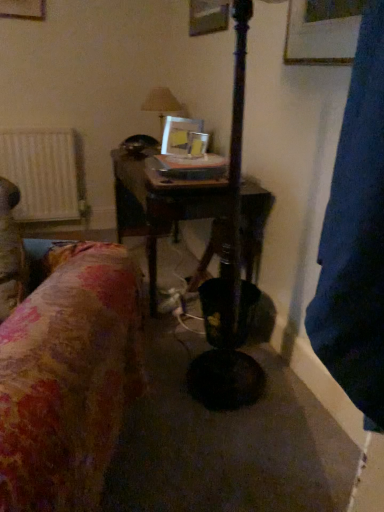
This screenshot has width=384, height=512. What do you see at coordinates (161, 105) in the screenshot?
I see `matte white lampshade at center` at bounding box center [161, 105].

Where is `metallic silver picture frame at center`? The height and width of the screenshot is (512, 384). metallic silver picture frame at center is located at coordinates (178, 131).

Are white textured radiator at left and matte white lampshade at center beside each other?

white textured radiator at left is not next to matte white lampshade at center, and they're not touching.

From the image's perspective, is white textured radiator at left under matte white lampshade at center?

Correct, white textured radiator at left appears lower than matte white lampshade at center in the image.

From the picture: How different are the orientations of white textured radiator at left and matte white lampshade at center in degrees?

90 degrees.

Considering the sizes of objects white textured radiator at left and matte white lampshade at center in the image provided, who is smaller, white textured radiator at left or matte white lampshade at center?

Smaller between the two is matte white lampshade at center.

Does matte white lampshade at center have a lesser width compared to white textured radiator at left?

Incorrect, the width of matte white lampshade at center is not less than that of white textured radiator at left.

Is the depth of matte white lampshade at center less than that of white textured radiator at left?

Yes, the depth of matte white lampshade at center is less than that of white textured radiator at left.

Considering the relative positions of metallic silver picture frame at center and matte white lampshade at center in the image provided, is metallic silver picture frame at center behind matte white lampshade at center?

No, metallic silver picture frame at center is closer to the viewer.

Is matte white lampshade at center surrounded by metallic silver picture frame at center?

No, matte white lampshade at center is not a part of metallic silver picture frame at center.

Is metallic silver picture frame at center touching matte white lampshade at center?

No, metallic silver picture frame at center is not with matte white lampshade at center.

Is matte white lampshade at center situated inside metallic silver picture frame at center or outside?

matte white lampshade at center is not enclosed by metallic silver picture frame at center.

From a real-world perspective, is matte white lampshade at center beneath metallic silver picture frame at center?

Incorrect, from a real-world perspective, matte white lampshade at center is higher than metallic silver picture frame at center.

From the image's perspective, is matte white lampshade at center located above or below metallic silver picture frame at center?

matte white lampshade at center is situated higher than metallic silver picture frame at center in the image.

Consider the image. Is metallic silver picture frame at center in front of or behind white textured radiator at left in the image?

metallic silver picture frame at center is positioned closer to the viewer than white textured radiator at left.

Does metallic silver picture frame at center have a greater width compared to white textured radiator at left?

No.

From the image's perspective, would you say metallic silver picture frame at center is positioned over white textured radiator at left?

Yes.

Which is more to the left, metallic silver picture frame at center or white textured radiator at left?

white textured radiator at left is more to the left.

Which is behind, point (26, 210) or point (169, 147)?

The point (26, 210) is farther from the camera.

Between white textured radiator at left and metallic silver picture frame at center, which one has smaller size?

metallic silver picture frame at center is smaller.

Is white textured radiator at left surrounding metallic silver picture frame at center?

No.

What's the angular difference between wooden table at center and white textured radiator at left's facing directions?

90 degrees separate the facing orientations of wooden table at center and white textured radiator at left.

Locate an element on the screen. This screenshot has width=384, height=512. table on the right of white textured radiator at left is located at coordinates (159, 207).

Which object is further away from the camera taking this photo, wooden table at center or white textured radiator at left?

Positioned behind is white textured radiator at left.

Is wooden table at center shorter than white textured radiator at left?

Incorrect, the height of wooden table at center does not fall short of that of white textured radiator at left.

I want to click on radiator located on the left of matte white lampshade at center, so click(x=43, y=173).

Where is `table lamp above the white textured radiator at left (from a real-world perspective)`? table lamp above the white textured radiator at left (from a real-world perspective) is located at coordinates (161, 105).

From the picture: From the image, which object appears to be farther from wooden table at center, metallic silver picture frame at center or matte white lampshade at center?

Based on the image, matte white lampshade at center appears to be further to wooden table at center.

From the image, which object appears to be nearer to metallic silver picture frame at center, white textured radiator at left or matte white lampshade at center?

Among the two, matte white lampshade at center is located nearer to metallic silver picture frame at center.

Estimate the real-world distances between objects in this image. Which object is closer to metallic silver picture frame at center, wooden table at center or white textured radiator at left?

Based on the image, wooden table at center appears to be nearer to metallic silver picture frame at center.

From the image, which object appears to be nearer to matte white lampshade at center, white textured radiator at left or wooden table at center?

Among the two, wooden table at center is located nearer to matte white lampshade at center.

From the picture: Estimate the real-world distances between objects in this image. Which object is further from white textured radiator at left, matte white lampshade at center or wooden table at center?

wooden table at center is further to white textured radiator at left.

From the image, which object appears to be nearer to matte white lampshade at center, wooden table at center or white textured radiator at left?

Based on the image, wooden table at center appears to be nearer to matte white lampshade at center.

When comparing their distances from wooden table at center, does metallic silver picture frame at center or white textured radiator at left seem closer?

The object closer to wooden table at center is metallic silver picture frame at center.

Looking at the image, which one is located further to white textured radiator at left, wooden table at center or matte white lampshade at center?

Among the two, wooden table at center is located further to white textured radiator at left.

Where is `picture frame between wooden table at center and matte white lampshade at center in the front-back direction`? This screenshot has height=512, width=384. picture frame between wooden table at center and matte white lampshade at center in the front-back direction is located at coordinates (178, 131).

At what (x,y) coordinates should I click in order to perform the action: click on table situated between white textured radiator at left and metallic silver picture frame at center from left to right. Please return your answer as a coordinate pair (x, y). Looking at the image, I should click on (159, 207).

Identify the location of table lamp between white textured radiator at left and metallic silver picture frame at center from left to right. (161, 105).

In order to click on table lamp between wooden table at center and white textured radiator at left from front to back in this screenshot , I will do `click(161, 105)`.